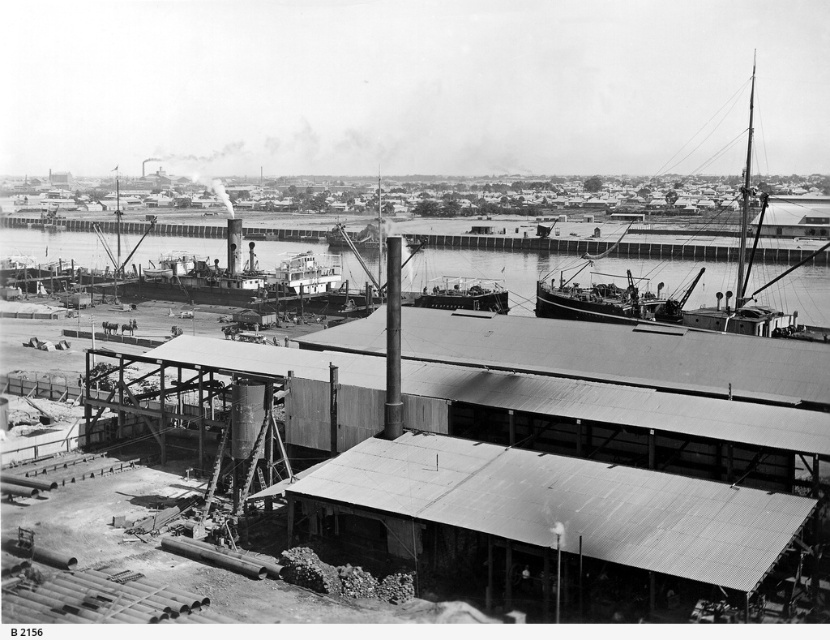
You are a crane operator who needs to lift cargo from the rusty metal ship at right and place it onto the smooth metal boat at center. Considering their heights, which vessel will require you to adjust the crane height more significantly?

The rusty metal ship at right is much taller than the smooth metal boat at center, so you will need to adjust the crane height more significantly when lifting cargo from the rusty metal ship at right to match its height before placing it onto the smooth metal boat at center.

You are a dock worker standing at the center of the image. You need to move to the rusty metal ship at right. Which direction should you head towards?

You should head towards the right direction to reach the rusty metal ship at right since it is located at point (686,285), which is to the right side of the image.

You are a dock worker trying to secure the rusty metal ship at right and the smooth metal boat at center. Which one is closer to the warehouse structure in the foreground?

The rusty metal ship at right is closer to the warehouse structure in the foreground because it is positioned in front of the smooth metal boat at center, which is further away from the warehouse.